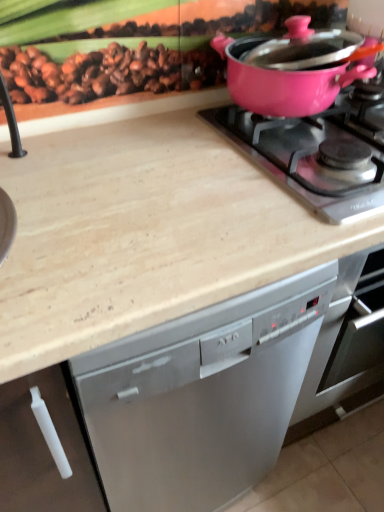
Question: Is point (365, 188) positioned closer to the camera than point (246, 101)?

Choices:
 (A) farther
 (B) closer

Answer: (B)

Question: From their relative heights in the image, would you say pink glossy pot at upper right is taller or shorter than pink glossy pot at upper right?

Choices:
 (A) short
 (B) tall

Answer: (A)

Question: Considering the real-world distances, which object is closest to the pink glossy pot at upper right?

Choices:
 (A) beige marble countertop at upper center
 (B) pink glossy pot at upper right

Answer: (B)

Question: Which object is positioned farthest from the beige marble countertop at upper center?

Choices:
 (A) pink glossy pot at upper right
 (B) pink glossy pot at upper right

Answer: (A)